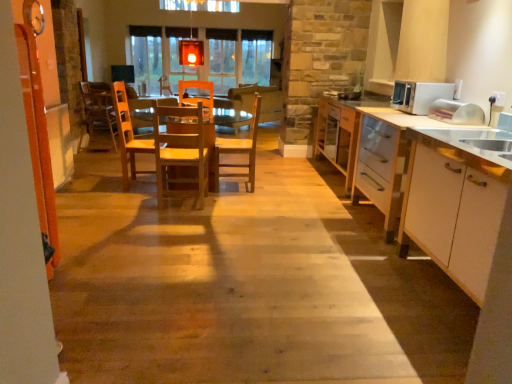
Question: Is point (236, 142) positioned closer to the camera than point (498, 230)?

Choices:
 (A) closer
 (B) farther

Answer: (B)

Question: From a real-world perspective, is wooden table at center positioned above or below white glossy cabinet at right?

Choices:
 (A) above
 (B) below

Answer: (B)

Question: Which of these objects is positioned farthest from the wooden chair at center, the first chair in the back-to-front sequence?

Choices:
 (A) white glossy microwave at right
 (B) wooden floor at center
 (C) translucent glass lantern at upper center
 (D) white glossy cabinet at right
 (E) wooden chair at center, arranged as the second chair when viewed from the back

Answer: (D)

Question: Which object is positioned farthest from the wooden chair at center, acting as the third chair starting from the back?

Choices:
 (A) white glossy cabinet at right
 (B) white glossy microwave at right
 (C) wooden chair at center, which is counted as the third chair, starting from the right
 (D) wooden chair at center, marked as the third chair in a left-to-right arrangement
 (E) wooden table at center

Answer: (C)